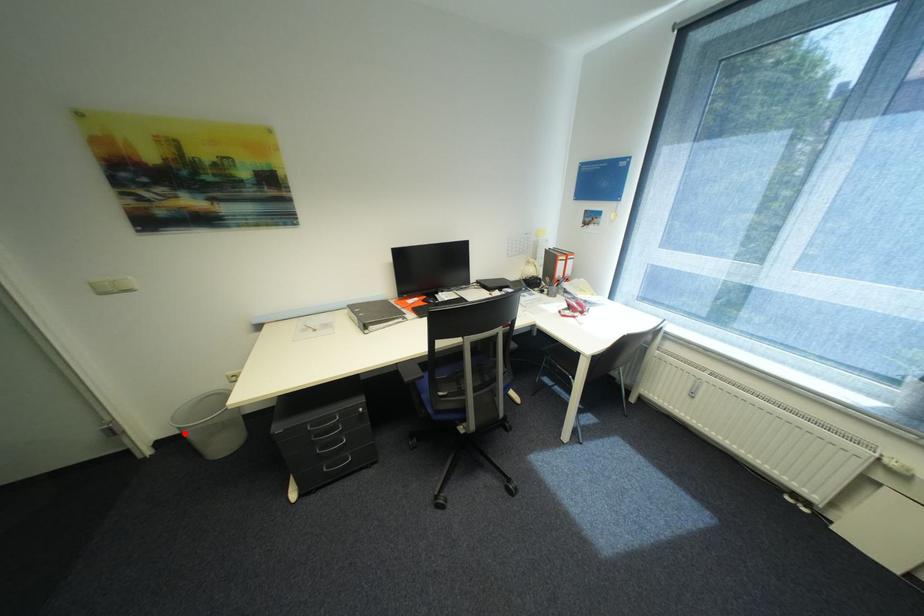
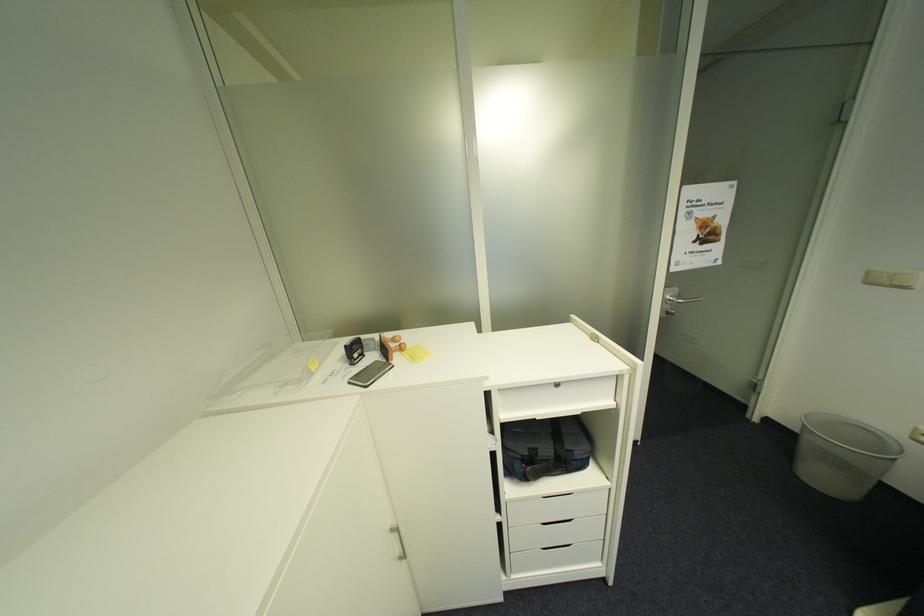
Question: I am providing you with two images of the same scene from different viewpoints. Given a red point in image1, look at the same physical point in image2. Is it:

Choices:
 (A) Closer to the viewpoint
 (B) Farther from the viewpoint

Answer: (B)